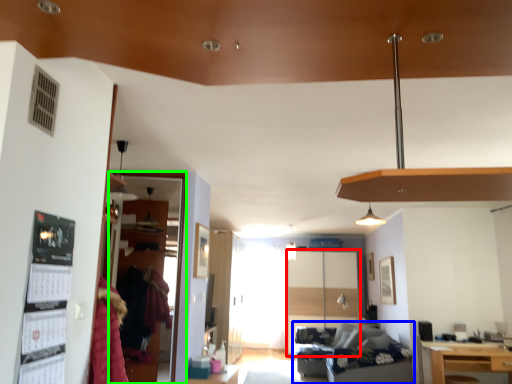
Question: Which object is positioned closest to glass door (highlighted by a red box)? Select from studio couch (highlighted by a blue box) and glass door (highlighted by a green box).

Choices:
 (A) studio couch
 (B) glass door

Answer: (A)